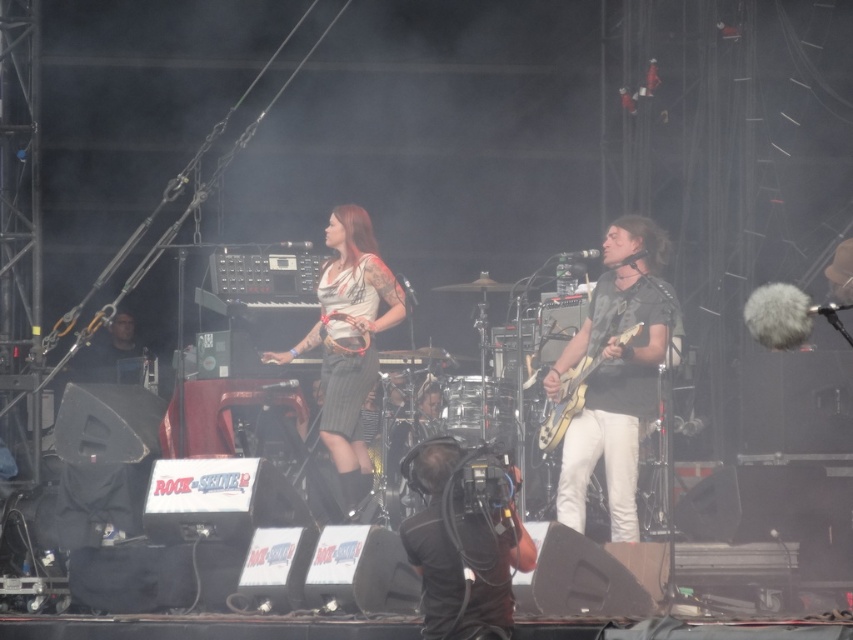
Question: Can you confirm if matte white shirt at center is thinner than shiny metallic guitar at center?

Choices:
 (A) no
 (B) yes

Answer: (A)

Question: Which point is farther from the camera taking this photo?

Choices:
 (A) (549, 401)
 (B) (335, 224)
 (C) (450, 508)

Answer: (B)

Question: Among these objects, which one is farthest from the camera?

Choices:
 (A) shiny metallic guitar at center
 (B) matte white shirt at center
 (C) black matte guitar at right

Answer: (B)

Question: Does black fabric camera at lower center have a larger size compared to matte white shirt at center?

Choices:
 (A) no
 (B) yes

Answer: (A)

Question: Which point is farther to the camera?

Choices:
 (A) black fabric camera at lower center
 (B) black matte guitar at right

Answer: (B)

Question: Can you confirm if black fabric camera at lower center is smaller than matte white shirt at center?

Choices:
 (A) no
 (B) yes

Answer: (B)